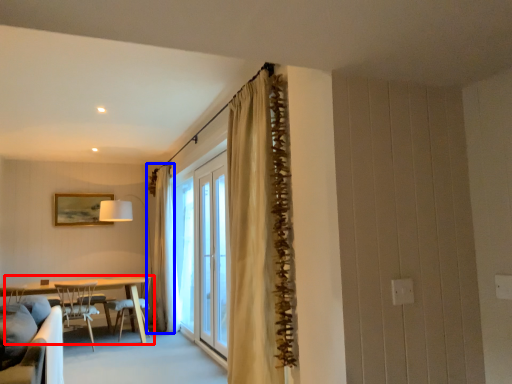
Question: Among these objects, which one is nearest to the camera, kitchen & dining room table (highlighted by a red box) or curtain (highlighted by a blue box)?

Choices:
 (A) kitchen & dining room table
 (B) curtain

Answer: (A)